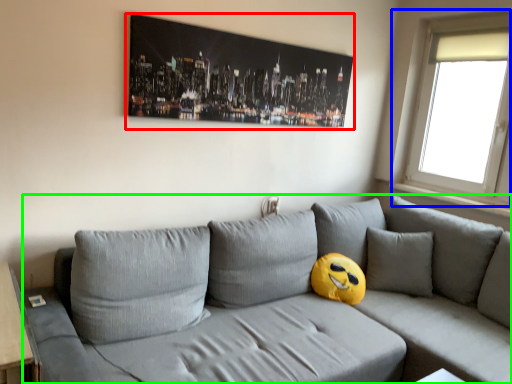
Question: Which object is positioned closest to picture frame (highlighted by a red box)? Select from window (highlighted by a blue box) and studio couch (highlighted by a green box).

Choices:
 (A) window
 (B) studio couch

Answer: (B)